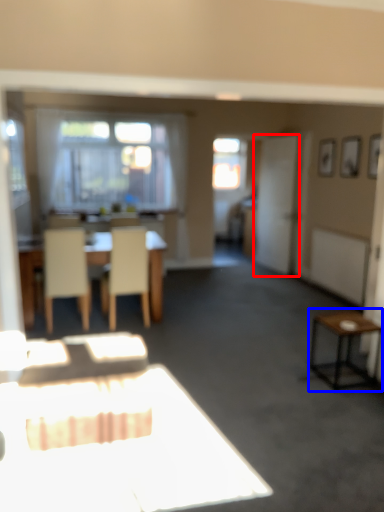
Question: Which object appears closest to the camera in this image, screen door (highlighted by a red box) or side table (highlighted by a blue box)?

Choices:
 (A) screen door
 (B) side table

Answer: (B)